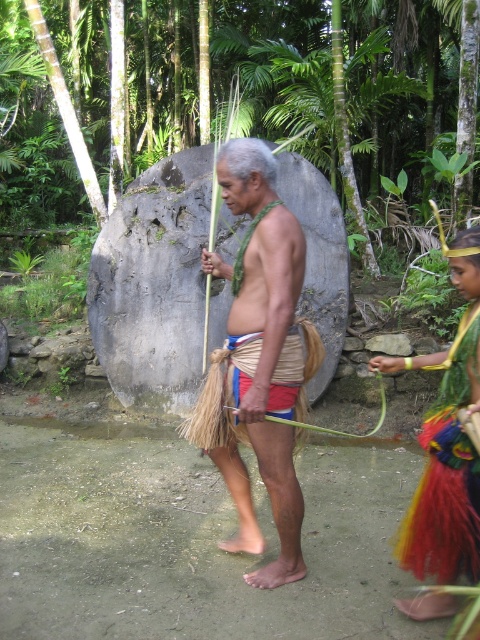
Question: Is bare skin at center to the right of multicolored woven skirt at right from the viewer's perspective?

Choices:
 (A) no
 (B) yes

Answer: (A)

Question: Which point is closer to the camera?

Choices:
 (A) (472, 284)
 (B) (278, 454)
 (C) (171, 60)

Answer: (A)

Question: Which object appears farthest from the camera in this image?

Choices:
 (A) multicolored woven skirt at right
 (B) bare skin at center

Answer: (B)

Question: Does green leafy jungle at upper center have a lesser width compared to multicolored woven skirt at right?

Choices:
 (A) no
 (B) yes

Answer: (A)

Question: Does green leafy jungle at upper center have a lesser width compared to bare skin at center?

Choices:
 (A) no
 (B) yes

Answer: (A)

Question: Among these objects, which one is farthest from the camera?

Choices:
 (A) bare skin at center
 (B) green leafy jungle at upper center

Answer: (B)